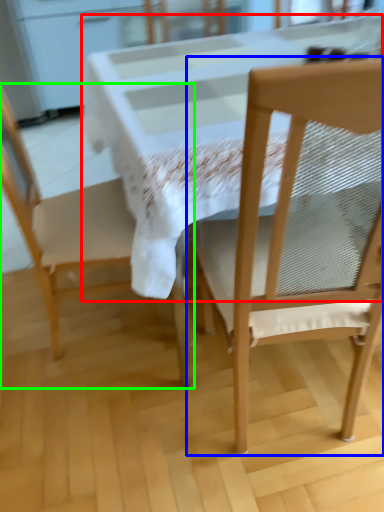
Question: Which object is positioned closest to round table (highlighted by a red box)? Select from chair (highlighted by a blue box) and chair (highlighted by a green box).

Choices:
 (A) chair
 (B) chair

Answer: (A)